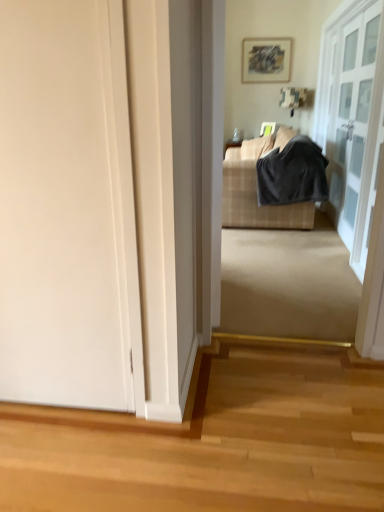
Question: From their relative heights in the image, would you say plaid fabric couch at center is taller or shorter than clear glass door at upper right, the second door positioned from the left?

Choices:
 (A) short
 (B) tall

Answer: (A)

Question: From the image's perspective, is plaid fabric couch at center positioned above or below clear glass door at upper right, which appears as the 2th door when viewed from the front?

Choices:
 (A) below
 (B) above

Answer: (A)

Question: Estimate the real-world distances between objects in this image. Which object is closer to the dark gray fabric at center?

Choices:
 (A) clear glass door at upper right, which appears as the 2th door when viewed from the front
 (B) plaid fabric couch at center
 (C) white matte door at left, placed as the first door when sorted from left to right
 (D) matte gray picture frame at upper center

Answer: (B)

Question: Based on their relative distances, which object is nearer to the clear glass door at upper right, which appears as the 2th door when viewed from the front?

Choices:
 (A) dark gray fabric at center
 (B) plaid fabric couch at center
 (C) matte gray picture frame at upper center
 (D) white matte door at left, the 2th door in the right-to-left sequence

Answer: (B)